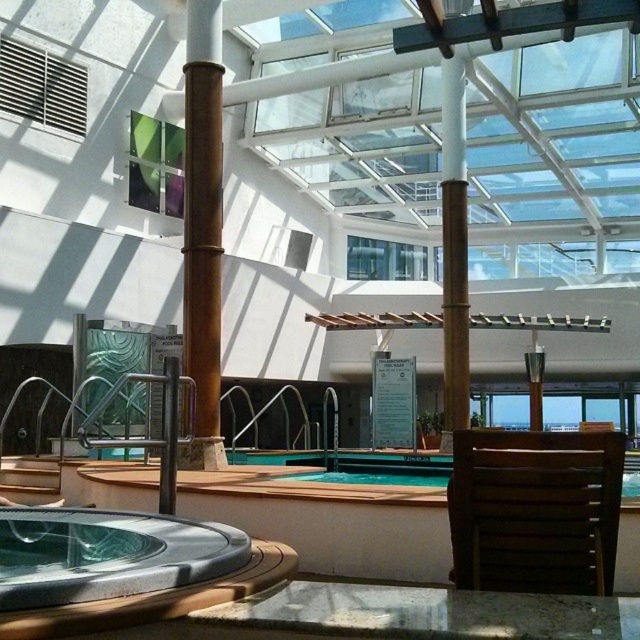
Between brown polished wood pillar at center and brown polished wood beam at center, which one is positioned lower?

brown polished wood beam at center is below.

Can you confirm if brown polished wood pillar at center is wider than brown polished wood beam at center?

Yes, brown polished wood pillar at center is wider than brown polished wood beam at center.

Between point (216, 205) and point (448, 252), which one is positioned behind?

The point (448, 252) is more distant.

This screenshot has width=640, height=640. I want to click on brown polished wood pillar at center, so click(202, 228).

Does brown wooden chair at center appear on the left side of brown polished wood beam at center?

Yes, brown wooden chair at center is to the left of brown polished wood beam at center.

Which is below, brown wooden chair at center or brown polished wood beam at center?

brown wooden chair at center

Describe the element at coordinates (534, 509) in the screenshot. I see `brown wooden chair at center` at that location.

Where is `brown wooden chair at center`? brown wooden chair at center is located at coordinates (534, 509).

Can you confirm if smooth gray hot tub at lower left is positioned below brown polished wood pillar at center?

Correct, smooth gray hot tub at lower left is located below brown polished wood pillar at center.

Is smooth gray hot tub at lower left shorter than brown polished wood pillar at center?

Yes, smooth gray hot tub at lower left is shorter than brown polished wood pillar at center.

Between point (129, 532) and point (195, 243), which one is positioned in front?

Point (129, 532)

Identify the location of smooth gray hot tub at lower left. (108, 554).